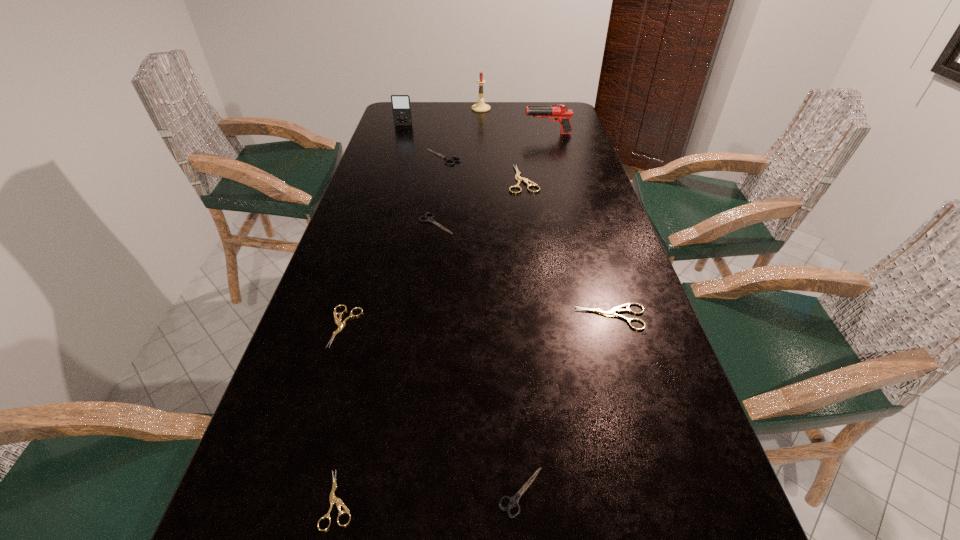
Identify which shears is the second closest to the shortest object. Please provide its 2D coordinates. Your answer should be formatted as a tuple, i.e. [(x, y)], where the tuple contains the x and y coordinates of a point satisfying the conditions above.

[(341, 325)]

Identify which shears is the closest to the second farthest black shears. Please provide its 2D coordinates. Your answer should be formatted as a tuple, i.e. [(x, y)], where the tuple contains the x and y coordinates of a point satisfying the conditions above.

[(518, 178)]

Identify which black shears is located as the nearest to the leftmost shears. Please provide its 2D coordinates. Your answer should be formatted as a tuple, i.e. [(x, y)], where the tuple contains the x and y coordinates of a point satisfying the conditions above.

[(430, 219)]

Choose which black shears is the second nearest neighbor to the nearest beige shears. Please provide its 2D coordinates. Your answer should be formatted as a tuple, i.e. [(x, y)], where the tuple contains the x and y coordinates of a point satisfying the conditions above.

[(430, 219)]

Locate which beige shears is the closest to the second beige shears from right to left. Please provide its 2D coordinates. Your answer should be formatted as a tuple, i.e. [(x, y)], where the tuple contains the x and y coordinates of a point satisfying the conditions above.

[(612, 312)]

Identify the location of beige shears object that ranks as the third closest to the eighth object from right to left. This screenshot has height=540, width=960. (518, 178).

This screenshot has width=960, height=540. Identify the location of free space that satisfies the following two spatial constraints: 1. on the front-facing side of the biggest black shears; 2. on the right side of the ninth nearest object. (394, 157).

Image resolution: width=960 pixels, height=540 pixels. In order to click on free space that satisfies the following two spatial constraints: 1. on the back side of the farthest black shears; 2. on the right side of the second shears from left to right in this screenshot , I will do `click(417, 157)`.

Where is `free spot that satisfies the following two spatial constraints: 1. on the back side of the third smallest beige shears; 2. on the left side of the rightmost black shears`? free spot that satisfies the following two spatial constraints: 1. on the back side of the third smallest beige shears; 2. on the left side of the rightmost black shears is located at coordinates (510, 317).

Find the location of a particular element. This screenshot has height=540, width=960. vacant space that satisfies the following two spatial constraints: 1. on the front side of the rightmost beige shears; 2. on the left side of the biggest beige shears is located at coordinates (542, 317).